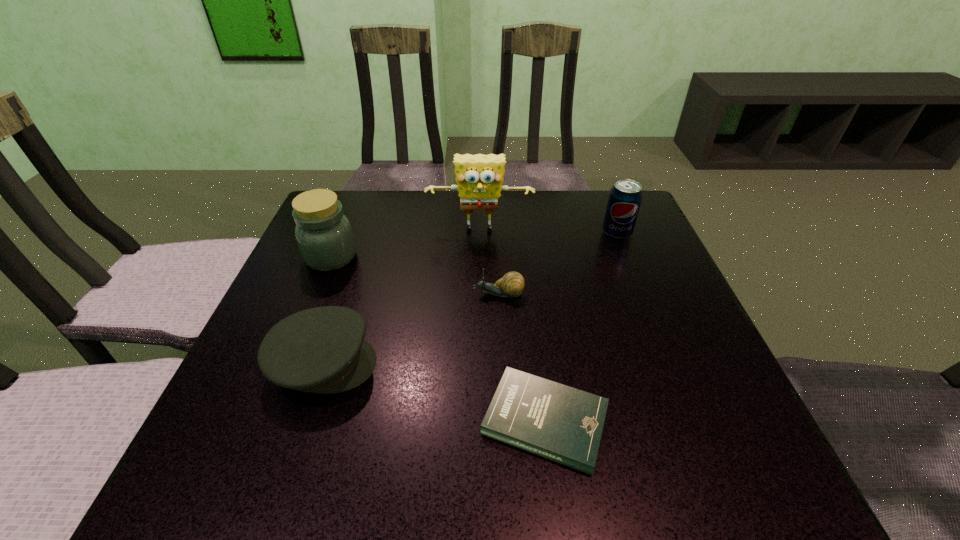
Find the location of a particular element. The image size is (960, 540). free space in the image that satisfies the following two spatial constraints: 1. on the face of the sponge; 2. on the front-facing side of the beret is located at coordinates (480, 364).

The width and height of the screenshot is (960, 540). I want to click on free space that satisfies the following two spatial constraints: 1. on the front-facing side of the second shortest object; 2. on the back side of the shortest object, so click(x=504, y=420).